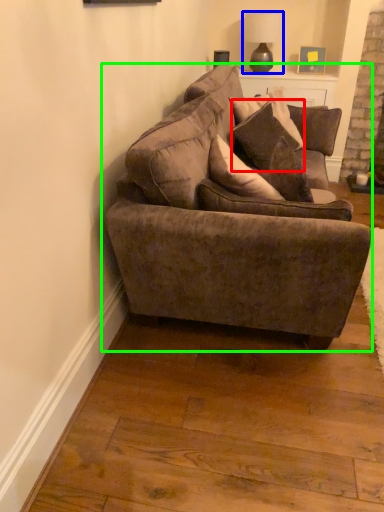
Question: Considering the real-world distances, which object is farthest from pillow (highlighted by a red box)? lamp (highlighted by a blue box) or studio couch (highlighted by a green box)?

Choices:
 (A) lamp
 (B) studio couch

Answer: (A)